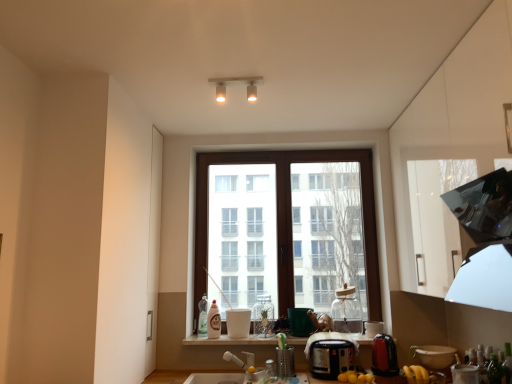
Question: Is the position of white glossy bottle at center, which is the second bottle in back-to-front order, more distant than that of white glossy cup at center, which appears as the 1th appliance when viewed from the left?

Choices:
 (A) yes
 (B) no

Answer: (A)

Question: Can you confirm if white glossy bottle at center, the 3th bottle from the right, is wider than white glossy cup at center, marked as the sixth appliance in a right-to-left arrangement?

Choices:
 (A) yes
 (B) no

Answer: (B)

Question: Does white glossy bottle at center, the 3th bottle from the right, appear on the left side of white glossy cup at center, marked as the sixth appliance in a right-to-left arrangement?

Choices:
 (A) no
 (B) yes

Answer: (B)

Question: Are white glossy bottle at center, which is the second bottle in back-to-front order, and white glossy cup at center, marked as the sixth appliance in a right-to-left arrangement, far apart?

Choices:
 (A) no
 (B) yes

Answer: (A)

Question: Does white glossy bottle at center, the third bottle from the front, have a larger size compared to white glossy cup at center, marked as the sixth appliance in a right-to-left arrangement?

Choices:
 (A) no
 (B) yes

Answer: (A)

Question: From a real-world perspective, is green matte mug at center, which ranks as the second appliance in left-to-right order, positioned above or below green glass bottle at lower right, marked as the 4th bottle in a left-to-right arrangement?

Choices:
 (A) below
 (B) above

Answer: (B)

Question: From the image's perspective, relative to green glass bottle at lower right, which appears as the fourth bottle when viewed from the back, is green matte mug at center, which ranks as the fifth appliance in right-to-left order, above or below?

Choices:
 (A) below
 (B) above

Answer: (A)

Question: Would you say green matte mug at center, which ranks as the second appliance in left-to-right order, is inside or outside green glass bottle at lower right, marked as the 4th bottle in a left-to-right arrangement?

Choices:
 (A) inside
 (B) outside

Answer: (B)

Question: Is green matte mug at center, which ranks as the second appliance in left-to-right order, in front of or behind green glass bottle at lower right, which is the first bottle from front to back, in the image?

Choices:
 (A) behind
 (B) front

Answer: (A)

Question: In terms of width, does black plastic toaster at center, the 4th appliance viewed from the right, look wider or thinner when compared to white glossy bottle at center, the 3th bottle from the right?

Choices:
 (A) thin
 (B) wide

Answer: (B)

Question: Is black plastic toaster at center, the 4th appliance viewed from the right, bigger or smaller than white glossy bottle at center, which ranks as the 2th bottle in left-to-right order?

Choices:
 (A) big
 (B) small

Answer: (A)

Question: From the image's perspective, is black plastic toaster at center, the third appliance viewed from the left, positioned above or below white glossy bottle at center, the 3th bottle from the right?

Choices:
 (A) below
 (B) above

Answer: (A)

Question: In the image, is black plastic toaster at center, the third appliance viewed from the left, positioned in front of or behind white glossy bottle at center, which ranks as the 2th bottle in left-to-right order?

Choices:
 (A) behind
 (B) front

Answer: (B)

Question: Choose the correct answer: Is white glossy bottle at center, which is the second bottle in back-to-front order, inside matte white light fixture at upper center or outside it?

Choices:
 (A) outside
 (B) inside

Answer: (A)

Question: Considering their positions, is white glossy bottle at center, which ranks as the 2th bottle in left-to-right order, located in front of or behind matte white light fixture at upper center?

Choices:
 (A) front
 (B) behind

Answer: (B)